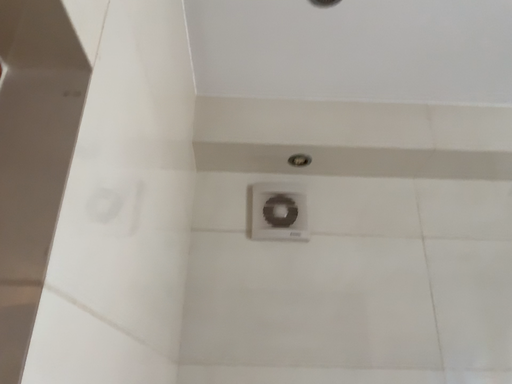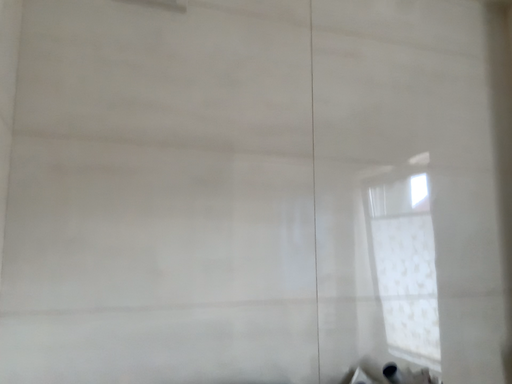
Question: How did the camera likely rotate when shooting the video?

Choices:
 (A) rotated right
 (B) rotated left

Answer: (A)